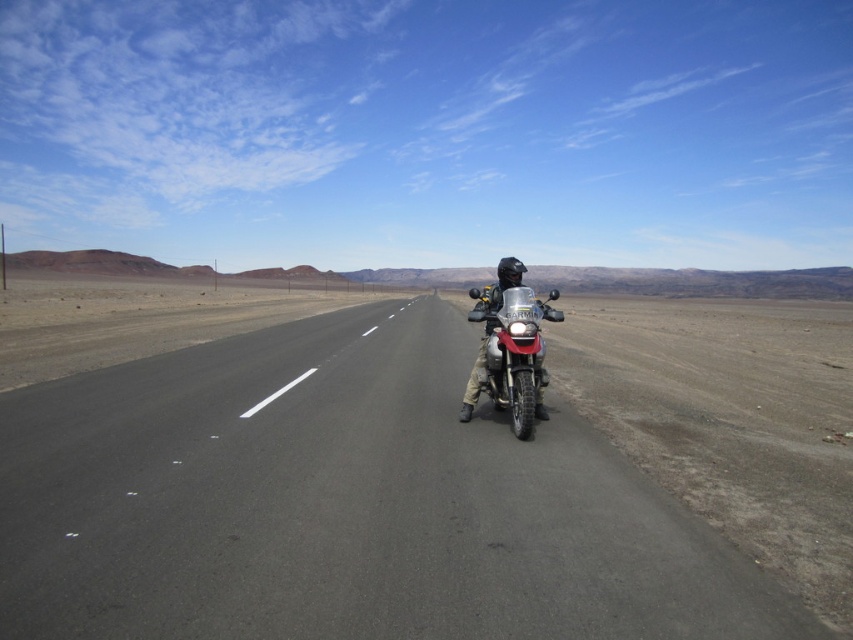
Question: Can you confirm if asphalt road at center is thinner than metallic silver motorcycle at center?

Choices:
 (A) no
 (B) yes

Answer: (A)

Question: Does asphalt road at center come behind metallic silver motorcycle at center?

Choices:
 (A) yes
 (B) no

Answer: (B)

Question: Which of the following is the farthest from the observer?

Choices:
 (A) (505, 392)
 (B) (688, 532)

Answer: (A)

Question: Considering the relative positions of asphalt road at center and metallic silver motorcycle at center in the image provided, where is asphalt road at center located with respect to metallic silver motorcycle at center?

Choices:
 (A) right
 (B) left

Answer: (B)

Question: Which of the following is the closest to the observer?

Choices:
 (A) (804, 616)
 (B) (511, 420)

Answer: (A)